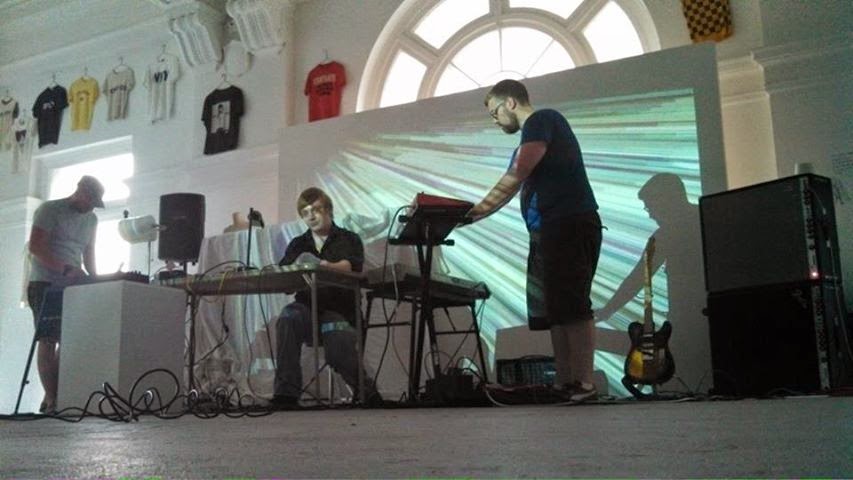
You are a GUI agent. You are given a task and a screenshot of the screen. Output one action in this format:
    pyautogui.click(x=<x>, y=<y>)
    Task: Click on the window
    This screenshot has width=853, height=480.
    Given the screenshot: What is the action you would take?
    pyautogui.click(x=402, y=72), pyautogui.click(x=124, y=165), pyautogui.click(x=447, y=15), pyautogui.click(x=565, y=2), pyautogui.click(x=612, y=26), pyautogui.click(x=442, y=85), pyautogui.click(x=478, y=60), pyautogui.click(x=519, y=45), pyautogui.click(x=507, y=71), pyautogui.click(x=550, y=65)